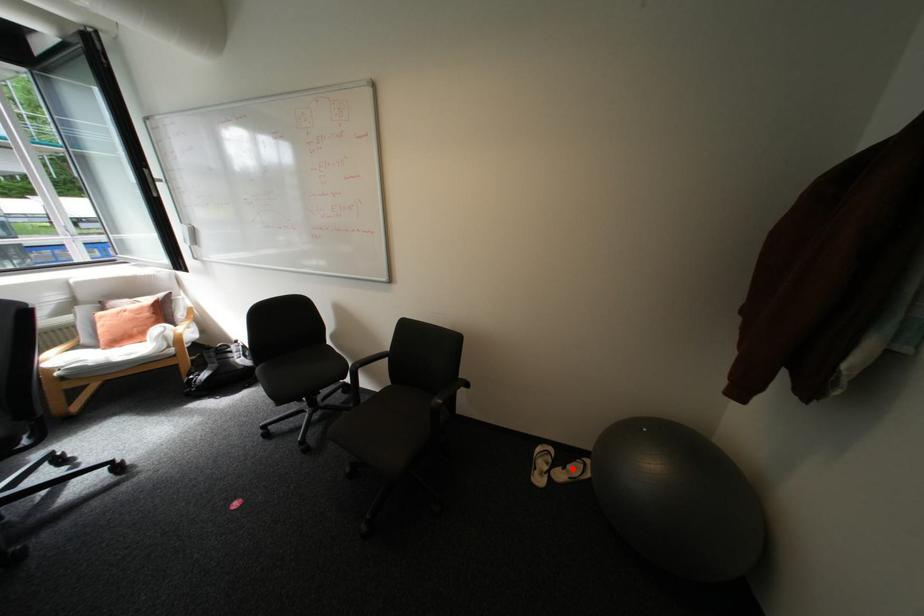
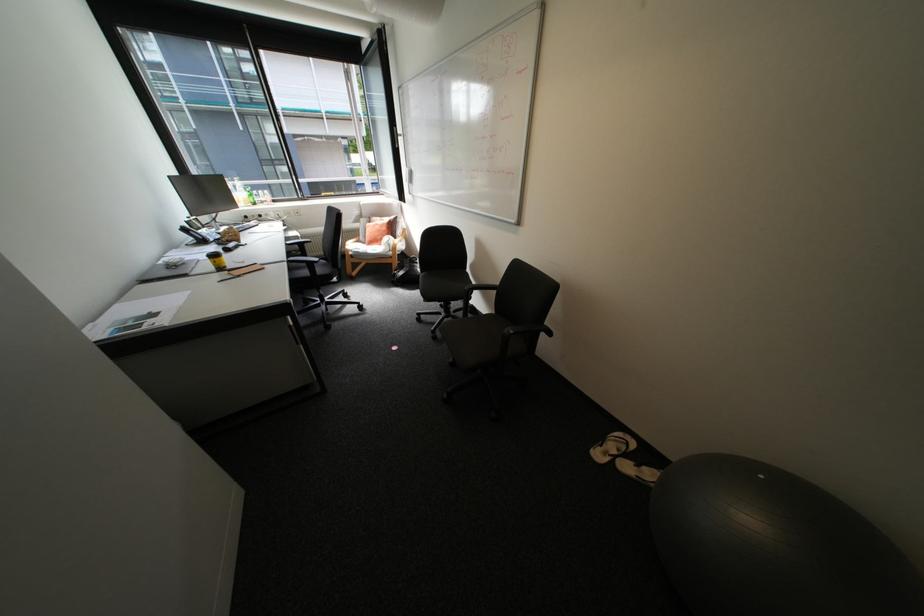
Where in the second image is the point corresponding to the highlighted location from the first image?

(645, 464)